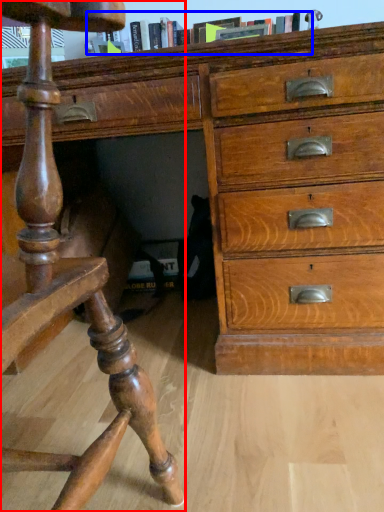
Question: Which object appears farthest to the camera in this image, furniture (highlighted by a red box) or book (highlighted by a blue box)?

Choices:
 (A) furniture
 (B) book

Answer: (B)